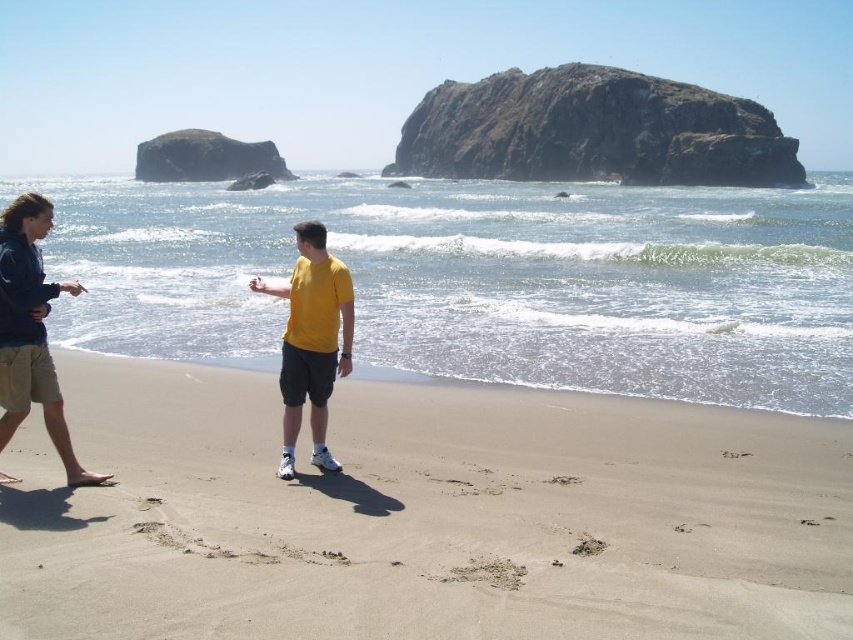
You are standing at the beach and want to walk from point A to point B. Point A is at coordinates point (334,310) and point B is at coordinates point (599,548). Given the beach terrain described, which direction should you head to reach point B from point A?

Since point (334,310) is behind point (599,548), you should walk forward towards point B from point A.

You are a photographer trying to capture the scene with the yellow matte shirt at center and the brown sandy footprint at lower center. From the photographer perspective, which object is positioned to the left?

The yellow matte shirt at center is positioned to the left of the brown sandy footprint at lower center.